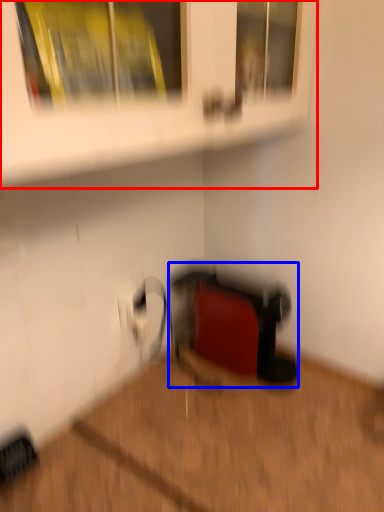
Question: Which object is further to the camera taking this photo, shelf (highlighted by a red box) or wide (highlighted by a blue box)?

Choices:
 (A) shelf
 (B) wide

Answer: (B)